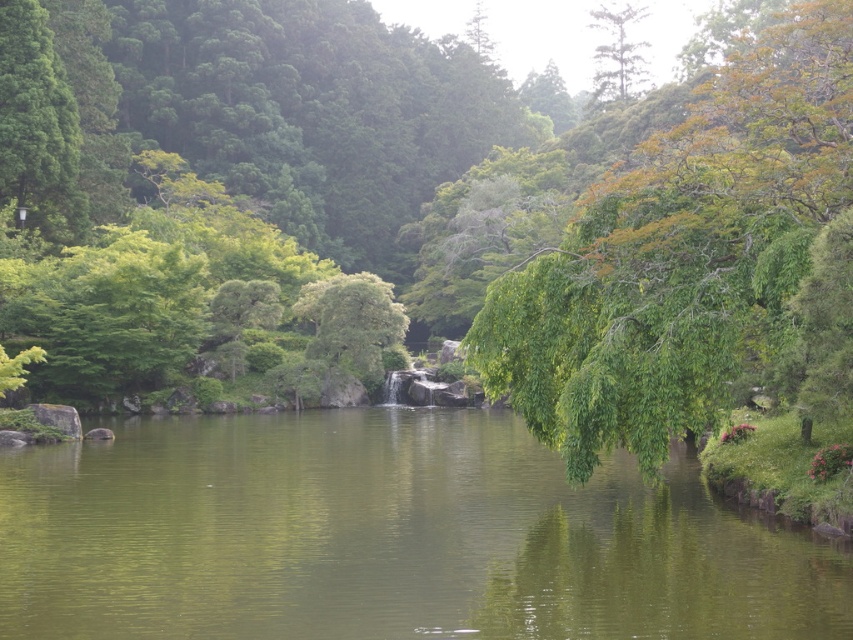
Consider the image. Is green smooth water at center below green leafy tree at right?

Yes.

Who is higher up, green smooth water at center or green leafy tree at right?

green leafy tree at right

Between point (228, 499) and point (701, 321), which one is positioned in front?

Point (701, 321)

I want to click on green smooth water at center, so click(387, 538).

Is point (665, 600) positioned after point (607, 45)?

That is False.

Between green smooth water at center and green leafy tree at upper center, which one appears on the right side from the viewer's perspective?

Positioned to the right is green leafy tree at upper center.

The image size is (853, 640). What do you see at coordinates (387, 538) in the screenshot?
I see `green smooth water at center` at bounding box center [387, 538].

You are a GUI agent. You are given a task and a screenshot of the screen. Output one action in this format:
    pyautogui.click(x=<x>, y=<y>)
    Task: Click on the green smooth water at center
    Image resolution: width=853 pixels, height=640 pixels.
    Given the screenshot: What is the action you would take?
    pyautogui.click(x=387, y=538)

Does point (643, 408) come farther from viewer compared to point (598, 65)?

No.

Can you confirm if green leafy tree at right is bigger than green leafy tree at upper center?

No.

This screenshot has width=853, height=640. Describe the element at coordinates (682, 257) in the screenshot. I see `green leafy tree at right` at that location.

Identify the location of green leafy tree at right. The width and height of the screenshot is (853, 640). [682, 257].